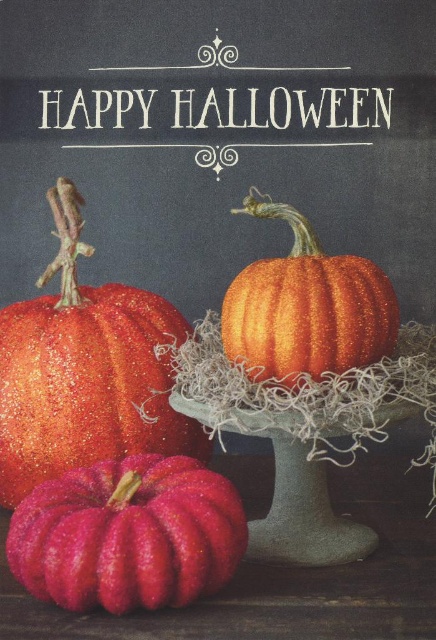
Question: Which point is farther to the camera?

Choices:
 (A) sparkly orange pumpkin at center
 (B) shiny pink pumpkin at lower left
 (C) glittery orange pumpkin at lower left

Answer: (C)

Question: Considering the real-world distances, which object is farthest from the glittery orange pumpkin at lower left?

Choices:
 (A) sparkly orange pumpkin at center
 (B) shiny pink pumpkin at lower left

Answer: (A)

Question: Is glittery orange pumpkin at lower left bigger than sparkly orange pumpkin at center?

Choices:
 (A) yes
 (B) no

Answer: (A)

Question: Where is glittery orange pumpkin at lower left located in relation to sparkly orange pumpkin at center in the image?

Choices:
 (A) left
 (B) right

Answer: (A)

Question: Observing the image, what is the correct spatial positioning of shiny pink pumpkin at lower left in reference to sparkly orange pumpkin at center?

Choices:
 (A) above
 (B) below

Answer: (B)

Question: Which point is farther from the camera taking this photo?

Choices:
 (A) (102, 316)
 (B) (288, 323)
 (C) (46, 508)

Answer: (A)